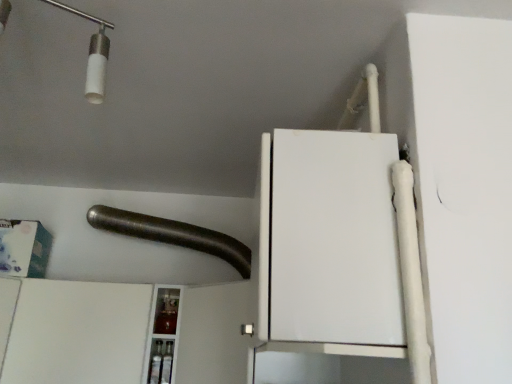
Question: From a real-world perspective, is white matte cabinet at lower left over brushed metal pipe at upper center?

Choices:
 (A) no
 (B) yes

Answer: (A)

Question: Is white matte cabinet at lower left shorter than brushed metal pipe at upper center?

Choices:
 (A) no
 (B) yes

Answer: (A)

Question: Is white matte cabinet at lower left facing away from brushed metal pipe at upper center?

Choices:
 (A) yes
 (B) no

Answer: (B)

Question: From the image's perspective, is white matte cabinet at lower left under brushed metal pipe at upper center?

Choices:
 (A) yes
 (B) no

Answer: (A)

Question: Is brushed metal pipe at upper center located within white matte cabinet at lower left?

Choices:
 (A) yes
 (B) no

Answer: (B)

Question: Is white matte cabinet at lower left positioned behind brushed metal pipe at upper center?

Choices:
 (A) no
 (B) yes

Answer: (A)

Question: Is brushed metal pipe at upper center positioned behind white matte cabinet at lower left?

Choices:
 (A) no
 (B) yes

Answer: (B)

Question: Considering the relative sizes of brushed metal pipe at upper center and white matte cabinet at lower left in the image provided, is brushed metal pipe at upper center wider than white matte cabinet at lower left?

Choices:
 (A) no
 (B) yes

Answer: (B)

Question: From a real-world perspective, is brushed metal pipe at upper center located beneath white matte cabinet at lower left?

Choices:
 (A) no
 (B) yes

Answer: (A)

Question: From the image's perspective, does brushed metal pipe at upper center appear lower than white matte cabinet at lower left?

Choices:
 (A) yes
 (B) no

Answer: (B)

Question: Can you confirm if brushed metal pipe at upper center is bigger than white matte cabinet at lower left?

Choices:
 (A) yes
 (B) no

Answer: (B)

Question: Is brushed metal pipe at upper center facing towards white matte cabinet at lower left?

Choices:
 (A) yes
 (B) no

Answer: (B)

Question: Based on their positions, is white matte cabinet at lower left located to the left or right of brushed metal pipe at upper center?

Choices:
 (A) right
 (B) left

Answer: (B)